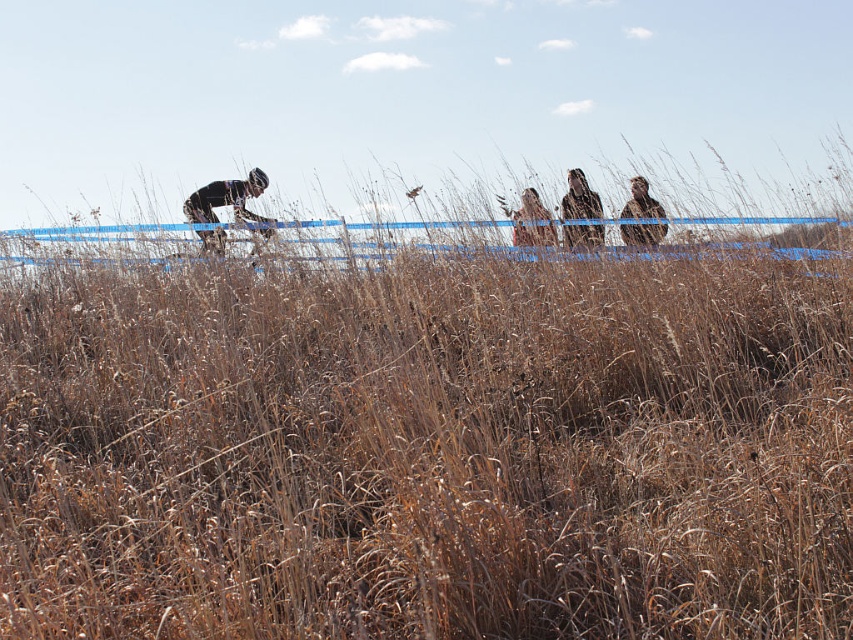
Does matte black cycling suit at left have a greater width compared to dark brown leather jacket at upper center?

Yes.

Is point (250, 186) positioned before point (566, 212)?

That is False.

Based on the photo, who is more distant from viewer, (219, 227) or (576, 198)?

Positioned behind is point (576, 198).

Locate an element on the screen. The image size is (853, 640). matte black cycling suit at left is located at coordinates (225, 198).

Who is positioned more to the left, brown fur coat at upper center or light brown hair at upper center?

light brown hair at upper center is more to the left.

Where is `brown fur coat at upper center`? This screenshot has width=853, height=640. brown fur coat at upper center is located at coordinates (641, 202).

Find the location of `brown fur coat at upper center`. brown fur coat at upper center is located at coordinates (641, 202).

Does dark brown leather jacket at upper center come behind light brown hair at upper center?

No.

Between dark brown leather jacket at upper center and light brown hair at upper center, which one is positioned higher?

Positioned higher is dark brown leather jacket at upper center.

Where is `dark brown leather jacket at upper center`? Image resolution: width=853 pixels, height=640 pixels. dark brown leather jacket at upper center is located at coordinates (579, 198).

Identify the location of dark brown leather jacket at upper center. The image size is (853, 640). (579, 198).